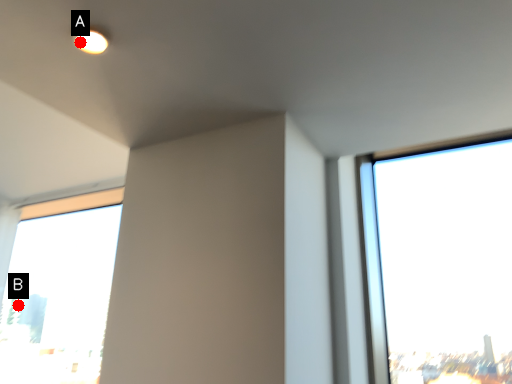
Question: Two points are circled on the image, labeled by A and B beside each circle. Which of the following is the farthest from the observer?

Choices:
 (A) A is further
 (B) B is further

Answer: (B)